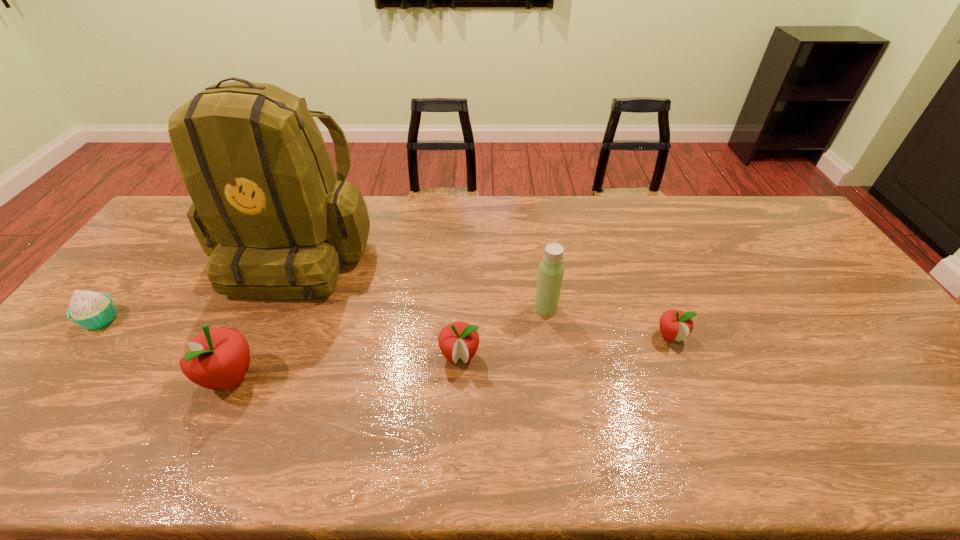
Please show where to add a apple on the right while keeping spacing even. Please provide its 2D coordinates. Your answer should be formatted as a tuple, i.e. [(x, y)], where the tuple contains the x and y coordinates of a point satisfying the conditions above.

[(865, 318)]